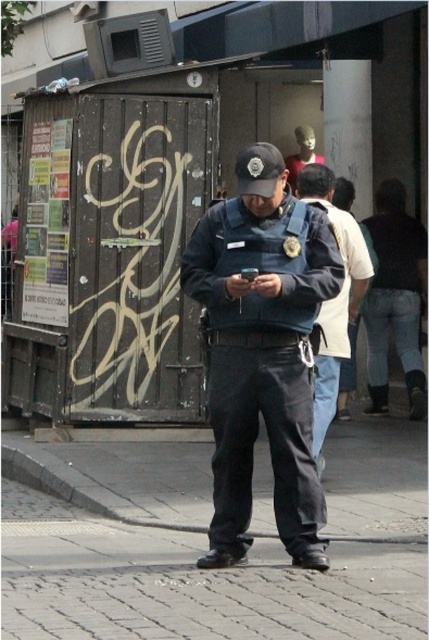
You are a delivery person trying to reach the police officer in the scene. The gray cobblestone pavement at center and denim jeans at right are in your path. Which object is closer to you as you approach?

The gray cobblestone pavement at center is closer to you because it is in front of the denim jeans at right, so you would encounter it first.

You are a delivery person trying to place a package on the gray cobblestone pavement at center. However, there are denim jeans at right nearby. Which object is shorter and can accommodate the package?

The gray cobblestone pavement at center is shorter than the denim jeans at right, so it can accommodate the package.